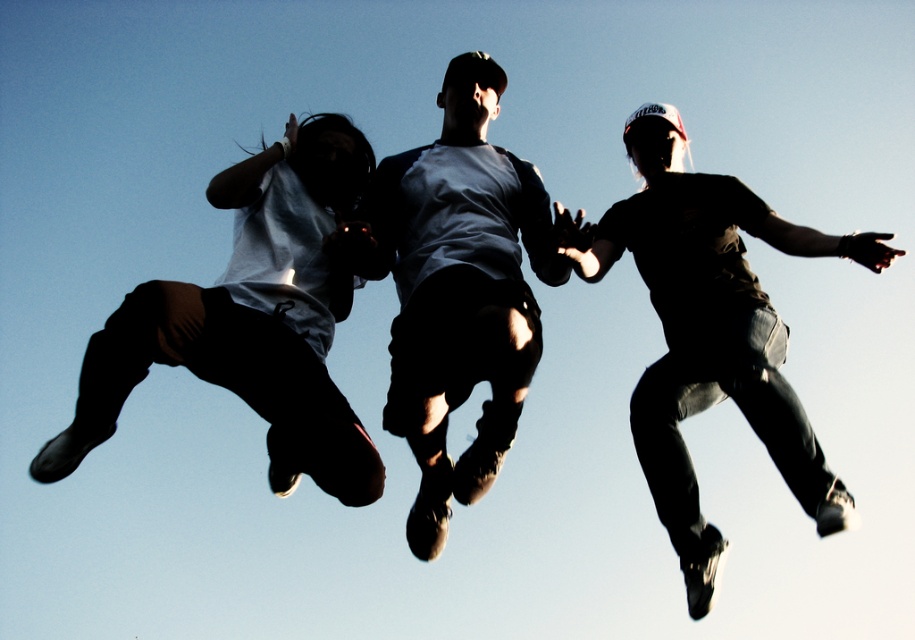
You are looking up at three people mid jump. Which of the following points corresponds to the center of the matte blue shirt at center? Choose from the options below. The options are point A at [456,289], point B at 0.501, 0.505, point C at 0.498, 0.502, and point D at 0.505, 0.501.

The point corresponding to the center of the matte blue shirt at center is point A at [456,289].

You are a photographer standing below the two individuals in the image. You notice the dark gray jeans at center and the matte black pants at left. Which pair of pants is higher from your viewpoint?

The dark gray jeans at center is above matte black pants at left, so from your viewpoint, the dark gray jeans at center is higher.

You are a photographer trying to capture the perfect shot of the matte blue shirt at center from below. Based on the scene description, where would you position your camera to ensure the shirt is centered in your frame?

The matte blue shirt at center is located at point coordinates of (x=456, y=289). To center it in the frame, position the camera so that the shirt aligns with the center point of the viewfinder.